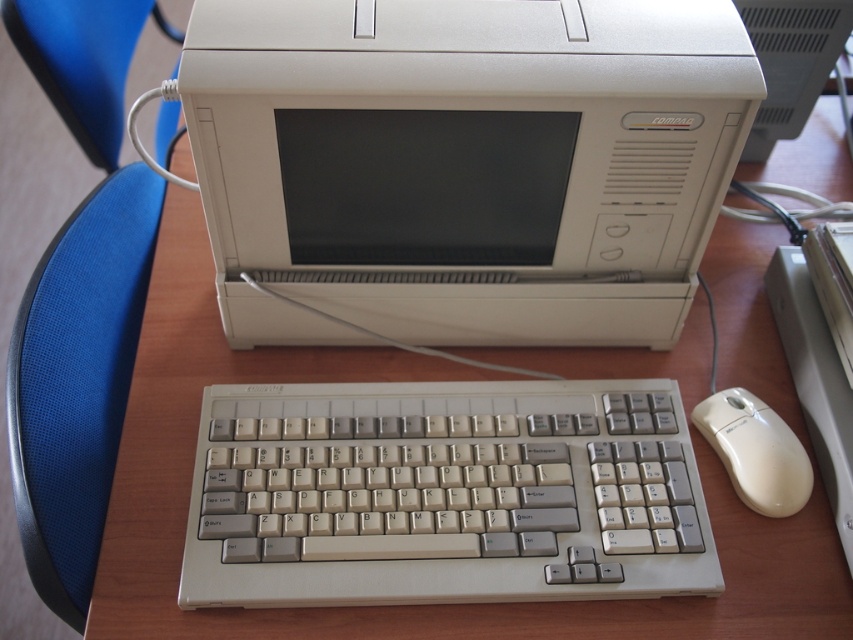
Between point (102, 48) and point (764, 76), which one is positioned in front?

Point (764, 76) is in front.

Can you confirm if blue fabric chair at left is positioned below beige plastic monitor at upper center?

Yes, blue fabric chair at left is below beige plastic monitor at upper center.

Measure the distance between point [106,237] and camera.

The distance of point [106,237] from camera is 34.05 inches.

Find the location of a particular element. The image size is (853, 640). blue fabric chair at left is located at coordinates (78, 298).

Can you confirm if beige plastic monitor at upper center is positioned below white plastic mouse at lower right?

Actually, beige plastic monitor at upper center is above white plastic mouse at lower right.

Is point (811, 67) behind point (759, 422)?

Yes, it is behind point (759, 422).

Does point (753, 120) come in front of point (764, 449)?

Yes.

Locate an element on the screen. beige plastic monitor at upper center is located at coordinates (790, 61).

Which is in front, point (537, 520) or point (792, 467)?

Point (537, 520) is more forward.

Between beige plastic keyboard at center and white plastic mouse at lower right, which one has less height?

With less height is white plastic mouse at lower right.

At what (x,y) coordinates should I click in order to perform the action: click on beige plastic keyboard at center. Please return your answer as a coordinate pair (x, y). Image resolution: width=853 pixels, height=640 pixels. Looking at the image, I should click on (444, 493).

Image resolution: width=853 pixels, height=640 pixels. Find the location of `beige plastic keyboard at center`. beige plastic keyboard at center is located at coordinates pyautogui.click(x=444, y=493).